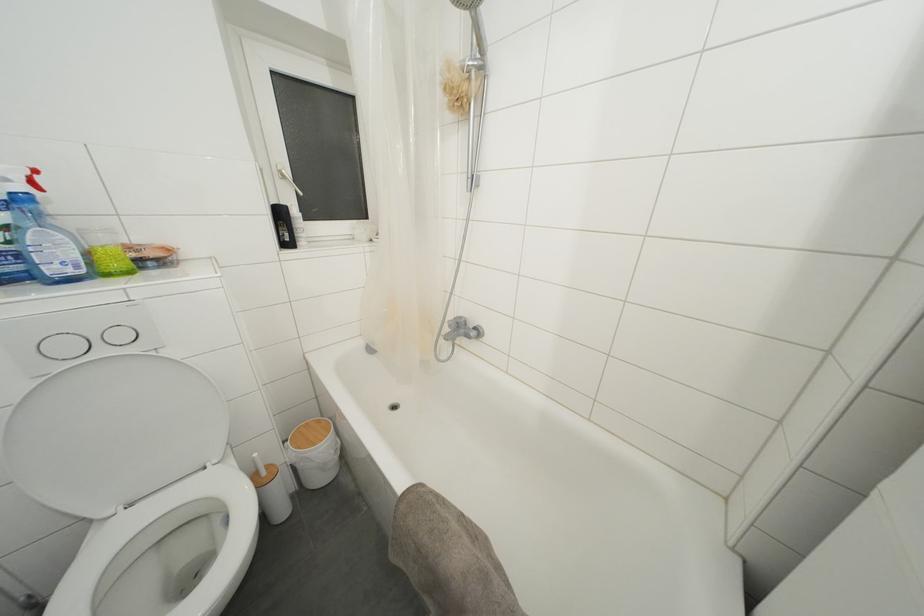
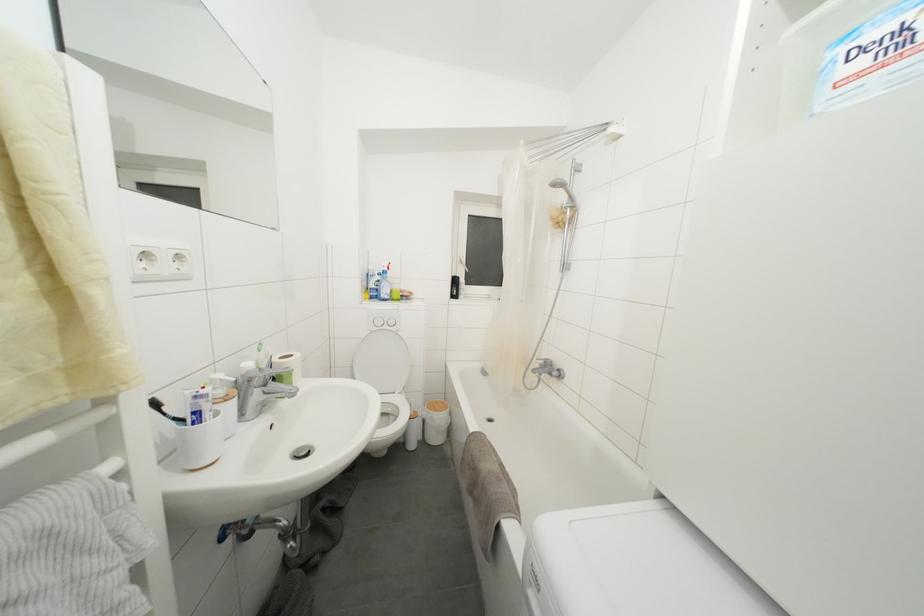
Find the pixel in the second image that matches [412,495] in the first image.

(480, 438)